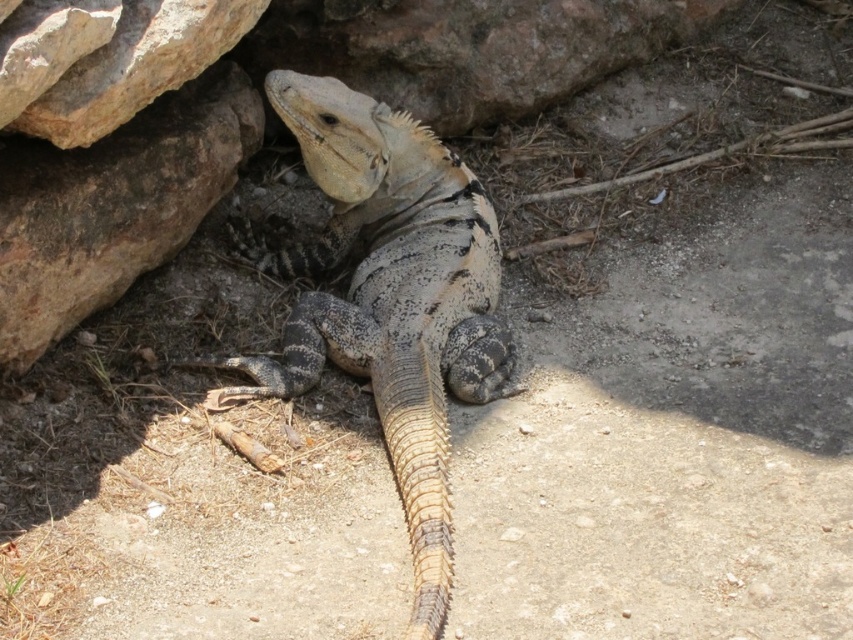
Question: Which point is closer to the camera taking this photo?

Choices:
 (A) (107, 54)
 (B) (178, 93)

Answer: (A)

Question: Does brown rough rock at upper left appear on the left side of smooth beige rock at upper left?

Choices:
 (A) no
 (B) yes

Answer: (B)

Question: Considering the relative positions of speckled scaly lizard at center and brown rough rock at upper left in the image provided, where is speckled scaly lizard at center located with respect to brown rough rock at upper left?

Choices:
 (A) below
 (B) above

Answer: (A)

Question: Which of the following is the closest to the observer?

Choices:
 (A) smooth beige rock at upper left
 (B) brown rough rock at upper left
 (C) speckled scaly lizard at center

Answer: (C)

Question: Which of the following is the farthest from the observer?

Choices:
 (A) speckled scaly lizard at center
 (B) smooth beige rock at upper left

Answer: (B)

Question: Is speckled scaly lizard at center closer to the viewer compared to smooth beige rock at upper left?

Choices:
 (A) yes
 (B) no

Answer: (A)